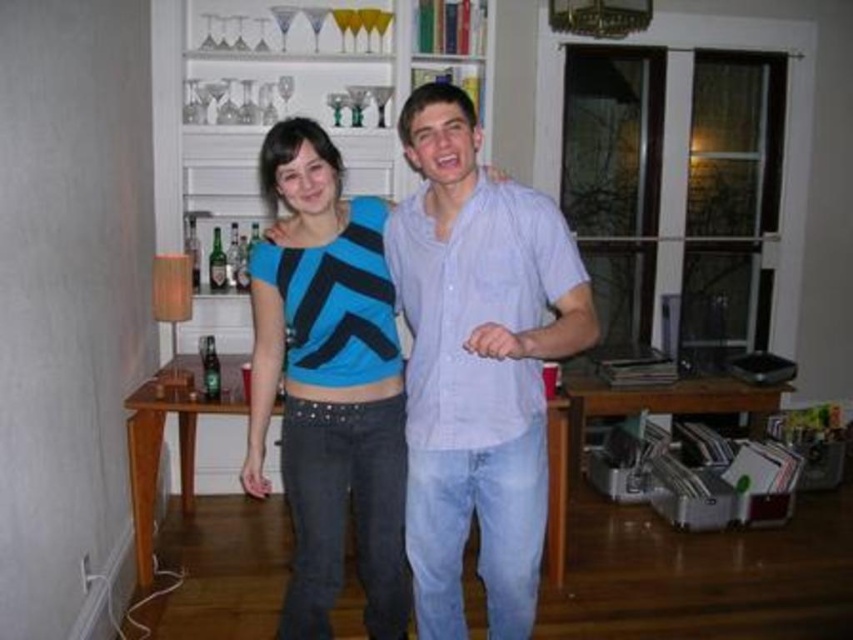
Does blue matte jersey at center lie in front of white wooden bookshelf at upper center?

That is True.

Is point (383, 572) less distant than point (258, 116)?

Yes, it is in front of point (258, 116).

Locate an element on the screen. This screenshot has height=640, width=853. blue matte jersey at center is located at coordinates (328, 385).

The height and width of the screenshot is (640, 853). What do you see at coordinates (477, 364) in the screenshot? I see `blue matte shirt at center` at bounding box center [477, 364].

Between blue matte shirt at center and blue matte jersey at center, which one is positioned higher?

Positioned higher is blue matte shirt at center.

Does point (467, 204) lie behind point (352, 198)?

No, (467, 204) is closer to viewer.

Find the location of `blue matte shirt at center`. blue matte shirt at center is located at coordinates (477, 364).

In the scene shown: Is blue matte shirt at center smaller than white wooden bookshelf at upper center?

Indeed, blue matte shirt at center has a smaller size compared to white wooden bookshelf at upper center.

Between point (512, 605) and point (412, 186), which one is positioned in front?

Point (512, 605) is more forward.

Which is in front, point (474, 468) or point (270, 54)?

Point (474, 468)

You are a GUI agent. You are given a task and a screenshot of the screen. Output one action in this format:
    pyautogui.click(x=<x>, y=<y>)
    Task: Click on the blue matte shirt at center
    
    Given the screenshot: What is the action you would take?
    click(477, 364)